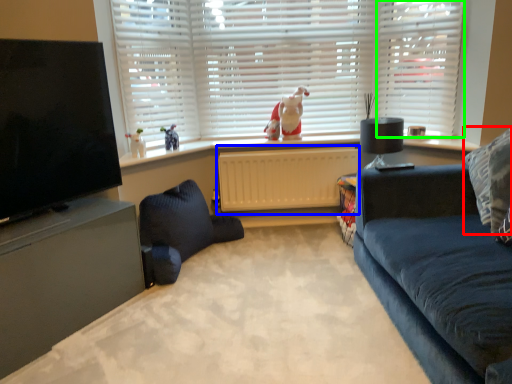
Question: Estimate the real-world distances between objects in this image. Which object is farther from pillow (highlighted by a red box), radiator (highlighted by a blue box) or window frame (highlighted by a green box)?

Choices:
 (A) radiator
 (B) window frame

Answer: (A)